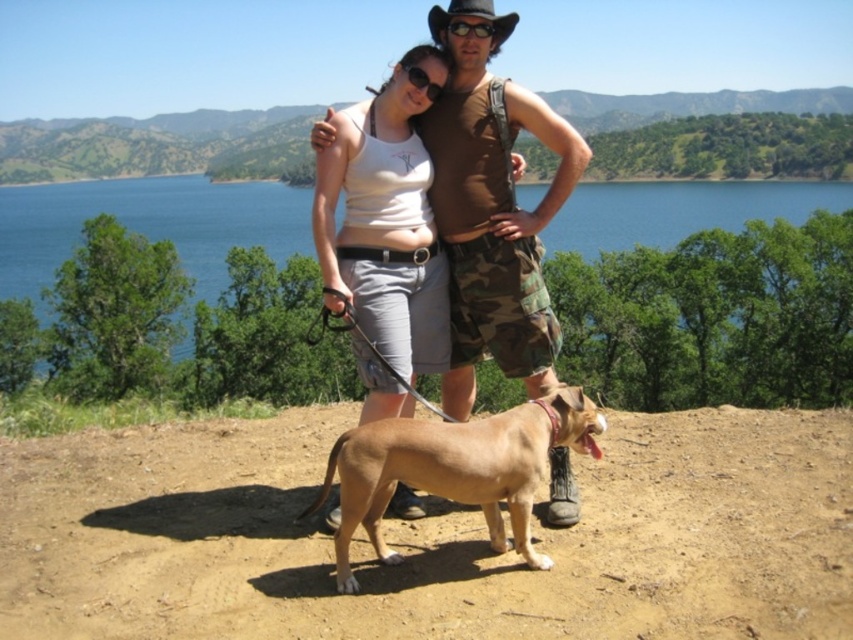
Is brown/camouflage shorts at center smaller than white cotton tank top at center?

Correct, brown/camouflage shorts at center occupies less space than white cotton tank top at center.

Is point (506, 193) in front of point (372, 321)?

No, (506, 193) is further to viewer.

Where is `brown/camouflage shorts at center`? Image resolution: width=853 pixels, height=640 pixels. brown/camouflage shorts at center is located at coordinates (492, 211).

Between blue water at center and white cotton tank top at center, which one is positioned higher?

blue water at center is above.

Can you confirm if blue water at center is smaller than white cotton tank top at center?

Incorrect, blue water at center is not smaller in size than white cotton tank top at center.

Is point (724, 228) farther from camera compared to point (419, 97)?

Yes.

The image size is (853, 640). I want to click on blue water at center, so [x=148, y=225].

Between point (485, 138) and point (563, 227), which one is positioned in front?

Point (485, 138) is more forward.

Looking at this image, measure the distance between point (515, 221) and camera.

Point (515, 221) is 16.06 feet from camera.

Does point (498, 300) come farther from viewer compared to point (183, 200)?

That is False.

Where is `brown/camouflage shorts at center`? Image resolution: width=853 pixels, height=640 pixels. brown/camouflage shorts at center is located at coordinates (492, 211).